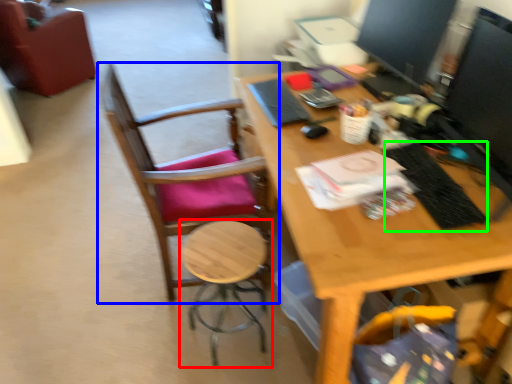
Question: Estimate the real-world distances between objects in this image. Which object is closer to stool (highlighted by a red box), chair (highlighted by a blue box) or laptop keyboard (highlighted by a green box)?

Choices:
 (A) chair
 (B) laptop keyboard

Answer: (A)